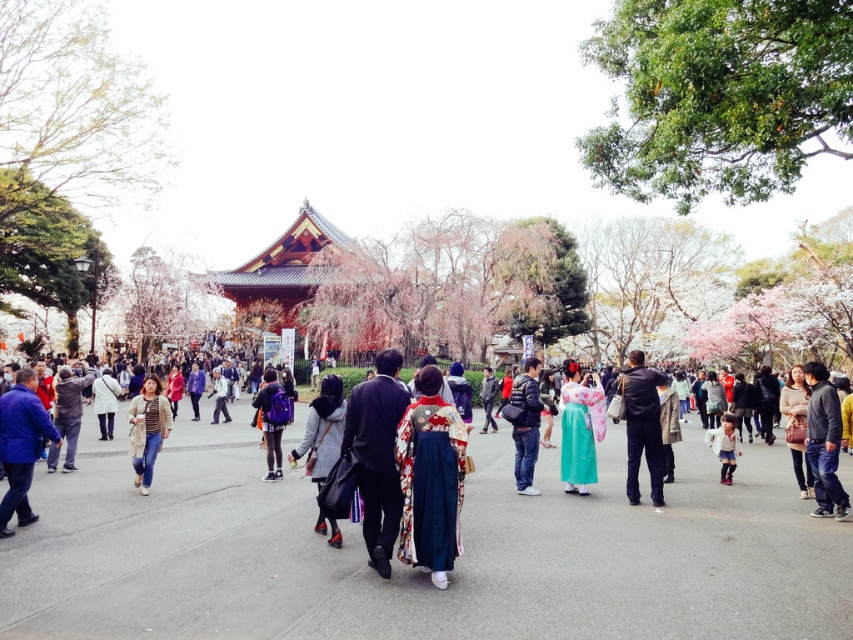
Can you confirm if striped jersey at center is taller than dark blue jeans at center?

In fact, striped jersey at center may be shorter than dark blue jeans at center.

Is striped jersey at center shorter than dark blue jeans at center?

Yes.

Who is more distant from viewer, (148, 387) or (534, 449)?

Positioned behind is point (148, 387).

Image resolution: width=853 pixels, height=640 pixels. In order to click on striped jersey at center in this screenshot , I will do coord(148,429).

Who is positioned more to the right, silky green kimono at center or dark blue jeans at center?

silky green kimono at center

Does silky green kimono at center have a smaller size compared to dark blue jeans at center?

Correct, silky green kimono at center occupies less space than dark blue jeans at center.

The height and width of the screenshot is (640, 853). I want to click on silky green kimono at center, so click(579, 429).

Between smooth asphalt path at center and knitted gray sweater at center, which one is positioned lower?

smooth asphalt path at center

At what (x,y) coordinates should I click in order to perform the action: click on smooth asphalt path at center. Please return your answer as a coordinate pair (x, y). The image size is (853, 640). Looking at the image, I should click on (416, 566).